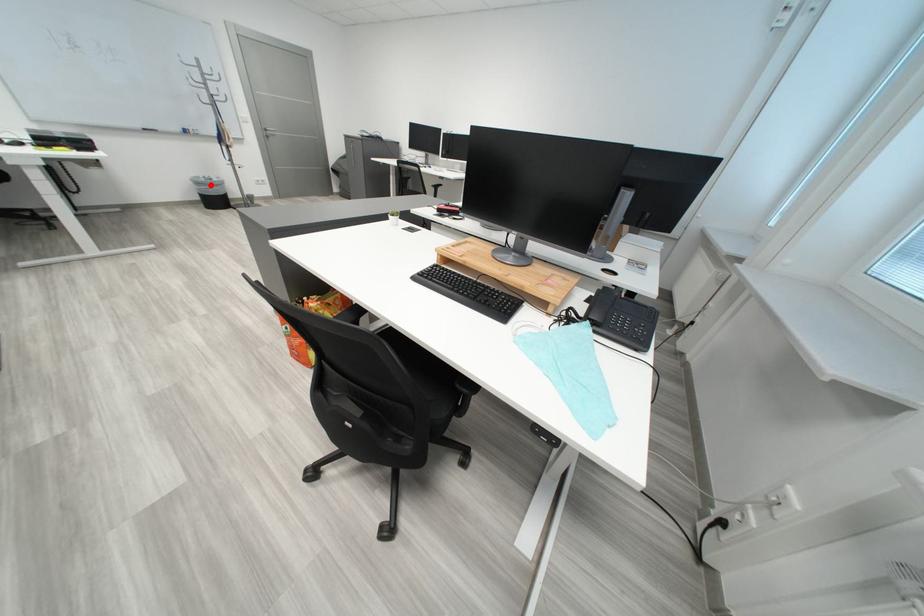
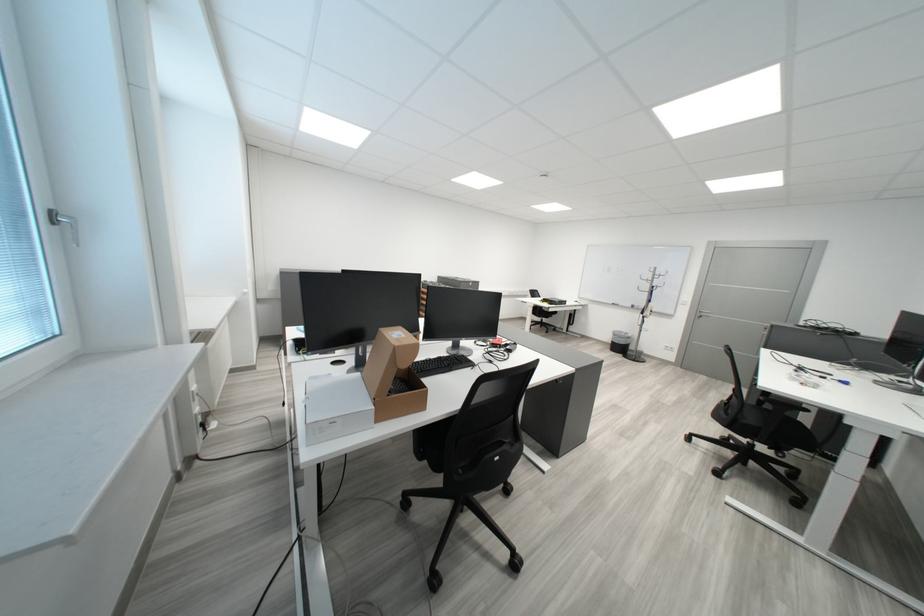
Find the pixel in the second image that matches the highlighted location in the first image.

(627, 336)